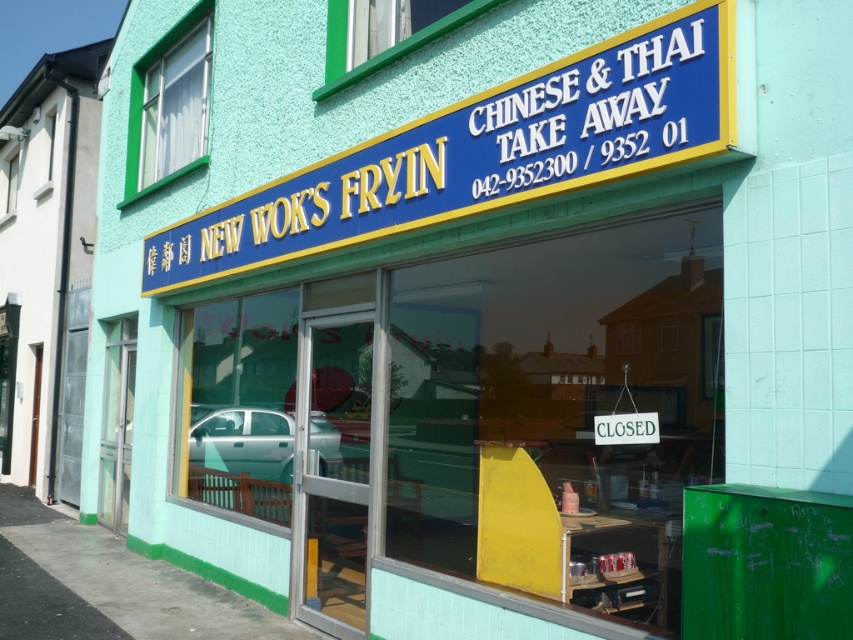
You are a delivery person standing at the entrance of New Wok Fryin, holding a package. You need to place the package on the teal metallic car at center. The blue plastic sign at upper center is in your way. Can you reach the car without moving the sign?

The distance between the blue plastic sign at upper center and the teal metallic car at center is 2.34 meters. Since the sign is above you, you can walk around it to reach the car without moving the sign.

You are a delivery person who needs to attach a note to the blue plastic sign at upper center and the teal metallic car at center. If the note for the sign must be wider than the sign itself, and the note for the car must be wider than the car, which note requires more space?

The blue plastic sign at upper center requires a wider note because its width is larger than the teal metallic car at center.

You are a customer standing in front of the restaurant. You notice the blue plastic sign at upper center and the teal metallic car at center. Which object is taller?

The blue plastic sign at upper center is much taller than the teal metallic car at center.